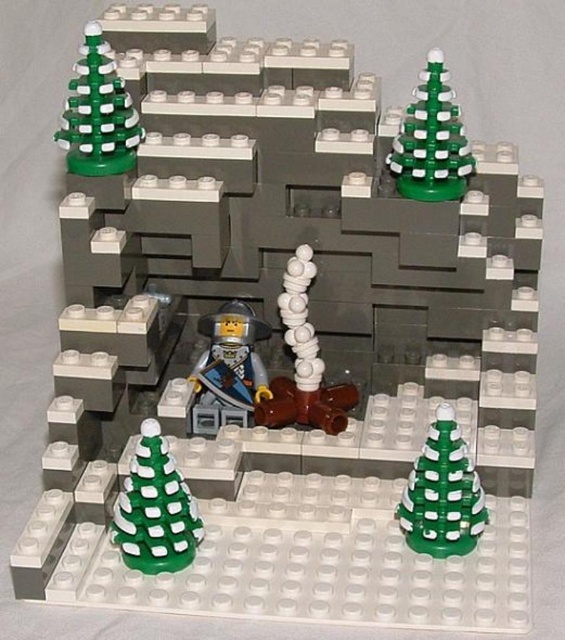
You are a toy delivery person who needs to pack the green matte christmas tree at lower left and the white matte pipe at center into a box. The box can only fit items that are narrower than 10 cm. According to the scene description, can both items be safely placed in the box?

The green matte christmas tree at lower left has a width less than the white matte pipe at center. Since the box can fit items narrower than 10 cm, but we don not know the exact width of the white matte pipe at center. Therefore, we cannot confirm if both items will fit without knowing the pipe width.

You are designing a LEGO layout and need to place a green matte christmas tree at upper left and a white matte pipe at center. Which object has a smaller diameter?

The green matte christmas tree at upper left is thinner than the white matte pipe at center, so the green matte christmas tree at upper left has a smaller diameter.

You are a LEGO architect designing a winter scene. You have a green matte christmas tree at lower left and a white matte pipe at center. Which object is smaller in size?

The green matte christmas tree at lower left is smaller in size compared to the white matte pipe at center according to the description.